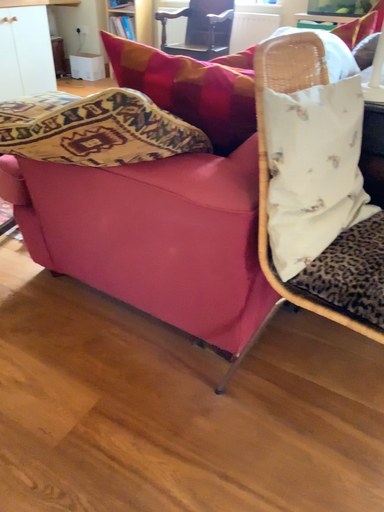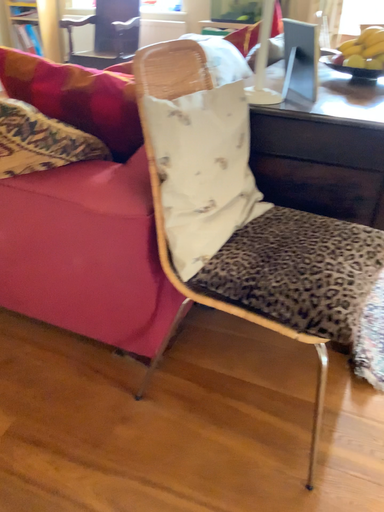
Question: How did the camera likely rotate when shooting the video?

Choices:
 (A) rotated left
 (B) rotated right

Answer: (B)